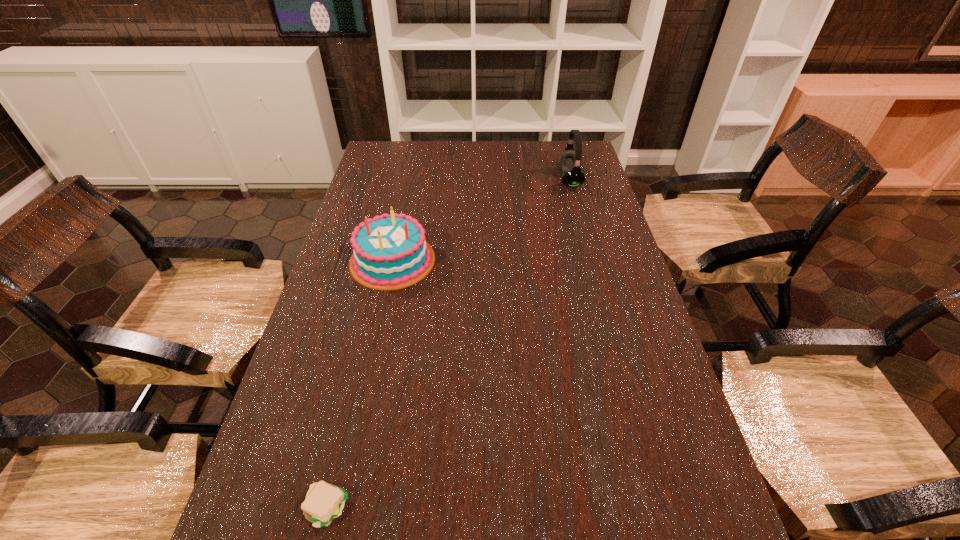
Find the location of a particular element. Image resolution: width=960 pixels, height=540 pixels. empty location between the second tallest object and the tallest object is located at coordinates (481, 220).

Locate an element on the screen. This screenshot has height=540, width=960. free spot between the rightmost object and the second shortest object is located at coordinates point(481,220).

Locate an element on the screen. The width and height of the screenshot is (960, 540). unoccupied area between the rightmost object and the nearest object is located at coordinates (448, 344).

Identify the location of free space between the farthest object and the second tallest object. (481, 220).

Image resolution: width=960 pixels, height=540 pixels. Identify the location of vacant space that's between the tallest object and the second nearest object. (481, 220).

I want to click on free area in between the second nearest object and the rightmost object, so (481, 220).

The height and width of the screenshot is (540, 960). I want to click on vacant point located between the second tallest object and the rightmost object, so click(481, 220).

This screenshot has width=960, height=540. In order to click on free space between the nearest object and the second shortest object in this screenshot , I will do `click(360, 384)`.

At what (x,y) coordinates should I click in order to perform the action: click on empty space that is in between the second farthest object and the farthest object. Please return your answer as a coordinate pair (x, y). Looking at the image, I should click on (481, 220).

Identify which object is located as the second nearest to the second nearest object. Please provide its 2D coordinates. Your answer should be formatted as a tuple, i.e. [(x, y)], where the tuple contains the x and y coordinates of a point satisfying the conditions above.

[(324, 502)]